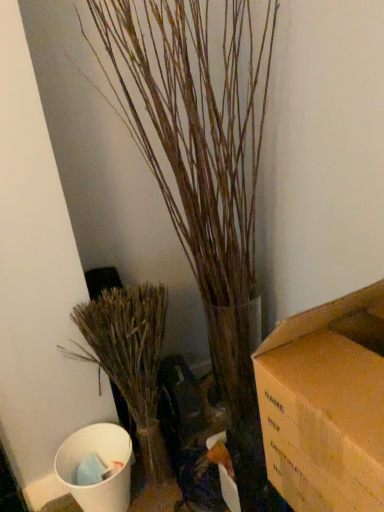
Question: From a real-world perspective, relative to bare wood branches at left, which appears as the 2th houseplant when viewed from the top, is brown textured plant at center, placed as the first houseplant when sorted from top to bottom, vertically above or below?

Choices:
 (A) above
 (B) below

Answer: (A)

Question: Is brown textured plant at center, placed as the first houseplant when sorted from top to bottom, taller or shorter than bare wood branches at left, which is the first houseplant in bottom-to-top order?

Choices:
 (A) tall
 (B) short

Answer: (A)

Question: Is point (112, 87) positioned closer to the camera than point (91, 317)?

Choices:
 (A) closer
 (B) farther

Answer: (B)

Question: From a real-world perspective, is bare wood branches at left, which appears as the 2th houseplant when viewed from the top, above or below brown textured plant at center, the 2th houseplant positioned from the bottom?

Choices:
 (A) above
 (B) below

Answer: (B)

Question: Is point (87, 309) positioned closer to the camera than point (228, 352)?

Choices:
 (A) farther
 (B) closer

Answer: (B)

Question: From the image's perspective, is bare wood branches at left, which appears as the 2th houseplant when viewed from the top, above or below brown textured plant at center, placed as the first houseplant when sorted from top to bottom?

Choices:
 (A) below
 (B) above

Answer: (A)

Question: Considering their positions, is bare wood branches at left, which appears as the 2th houseplant when viewed from the top, located in front of or behind brown textured plant at center, placed as the first houseplant when sorted from top to bottom?

Choices:
 (A) front
 (B) behind

Answer: (B)